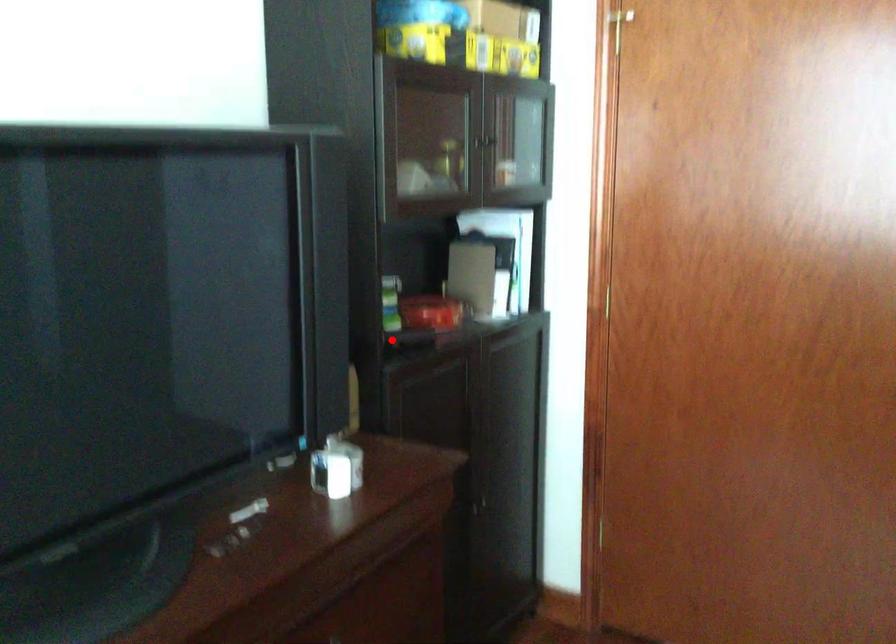
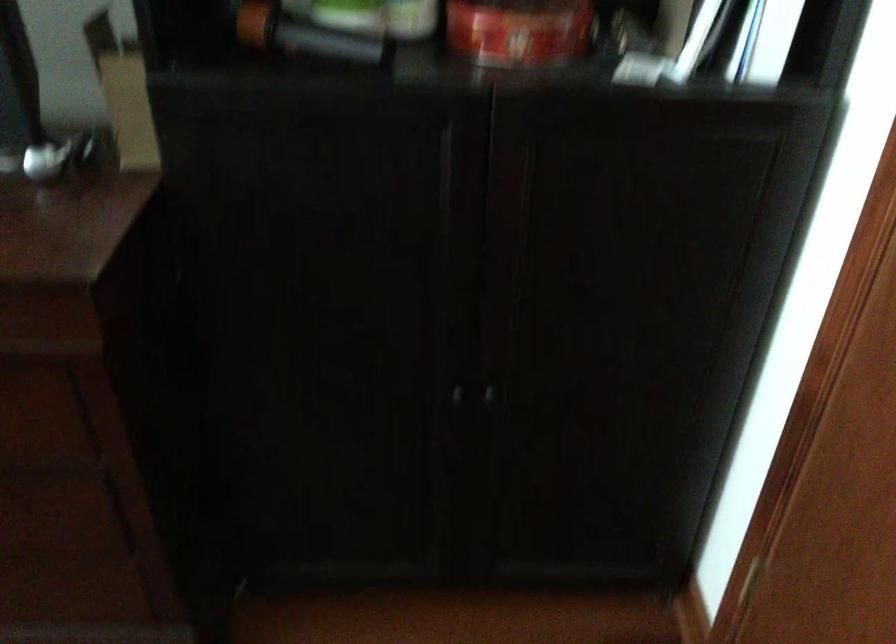
Question: I am providing you with two images of the same scene from different viewpoints. A red point is shown in image1. For the corresponding object point in image2, is it positioned nearer or farther from the camera?

Choices:
 (A) Nearer
 (B) Farther

Answer: (A)